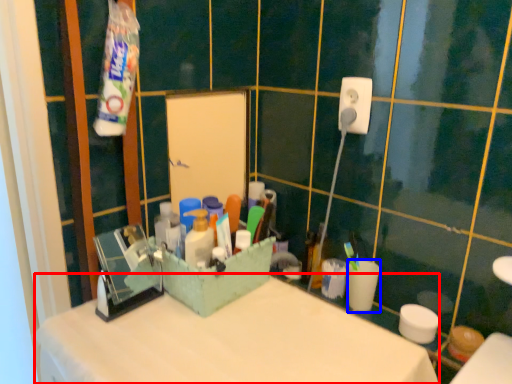
Question: Which object appears farthest to the camera in this image, counter top (highlighted by a red box) or coffee cup (highlighted by a blue box)?

Choices:
 (A) counter top
 (B) coffee cup

Answer: (B)